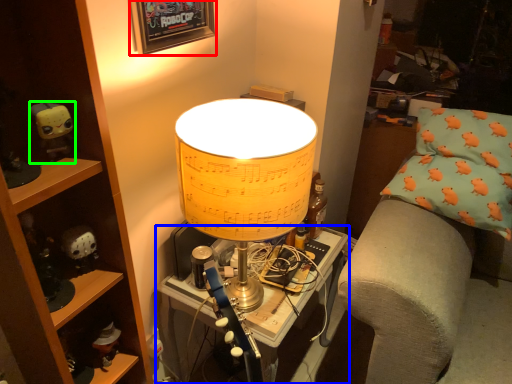
Question: Estimate the real-world distances between objects in this image. Which object is closer to picture frame (highlighted by a red box), table (highlighted by a blue box) or toy (highlighted by a green box)?

Choices:
 (A) table
 (B) toy

Answer: (B)